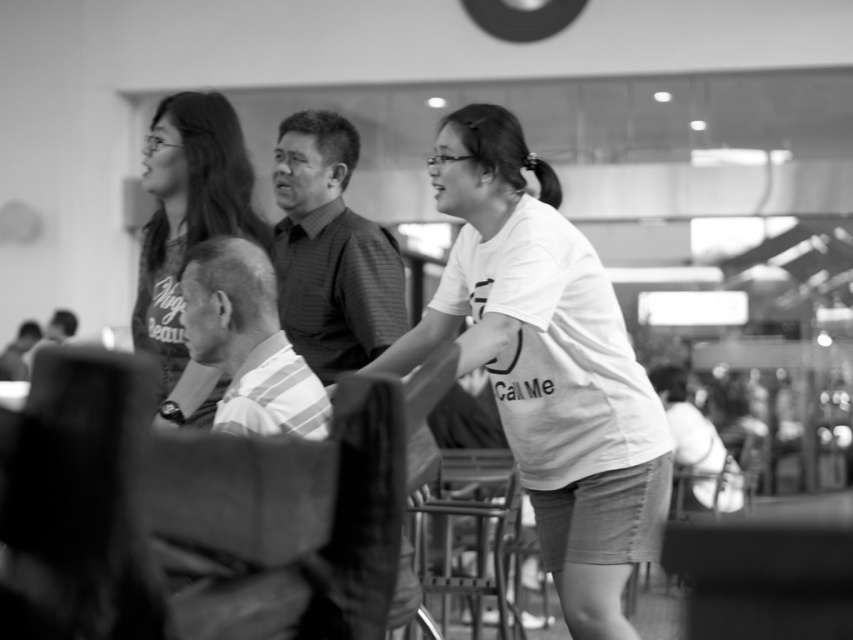
Question: Is textured dark shirt at center below striped shirt at center?

Choices:
 (A) no
 (B) yes

Answer: (A)

Question: Which is farther from the white cotton shirt at center?

Choices:
 (A) striped shirt at center
 (B) textured dark shirt at center
 (C) matte black shirt at upper left

Answer: (C)

Question: Estimate the real-world distances between objects in this image. Which object is farther from the white cotton shirt at center?

Choices:
 (A) striped shirt at center
 (B) textured dark shirt at center

Answer: (B)

Question: Is striped shirt at center below striped cotton shirt at center?

Choices:
 (A) no
 (B) yes

Answer: (A)

Question: Does matte black shirt at upper left have a greater width compared to striped cotton shirt at center?

Choices:
 (A) yes
 (B) no

Answer: (A)

Question: Among these points, which one is farthest from the camera?

Choices:
 (A) (358, 291)
 (B) (154, 211)

Answer: (B)